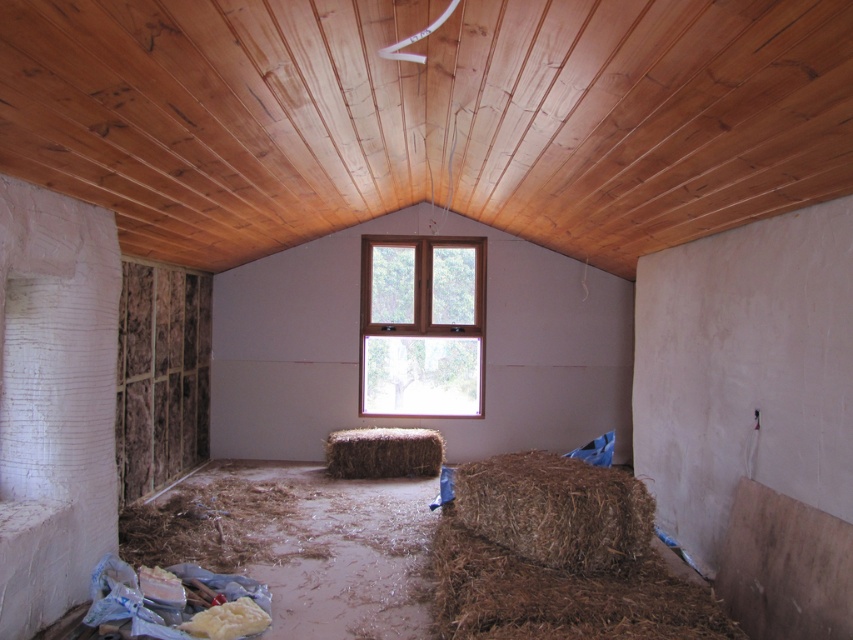
Question: Can you confirm if brown rough hay at lower right is positioned to the right of brown straw bale at center?

Choices:
 (A) no
 (B) yes

Answer: (B)

Question: Is brown wooden window at center to the right of brown rough hay at lower right from the viewer's perspective?

Choices:
 (A) no
 (B) yes

Answer: (A)

Question: Is brown straw bale at lower right closer to camera compared to brown rough hay at lower right?

Choices:
 (A) yes
 (B) no

Answer: (A)

Question: Considering the real-world distances, which object is closest to the brown straw bale at lower right?

Choices:
 (A) brown rough hay at lower right
 (B) brown straw bale at center
 (C) brown wooden window at center

Answer: (A)

Question: Among these points, which one is nearest to the camera?

Choices:
 (A) (708, 632)
 (B) (432, 476)

Answer: (A)

Question: Which point is farther from the camera taking this photo?

Choices:
 (A) (410, 472)
 (B) (442, 310)
 (C) (611, 529)

Answer: (B)